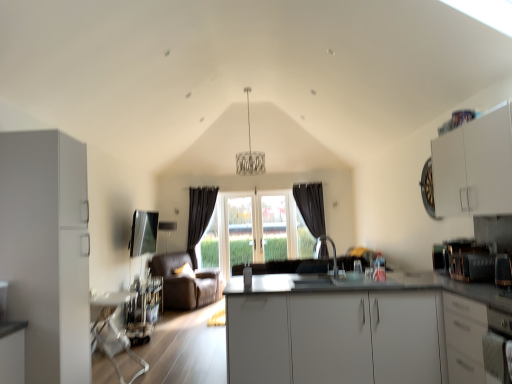
Question: Is point (203, 279) closer or farther from the camera than point (322, 188)?

Choices:
 (A) closer
 (B) farther

Answer: (A)

Question: Do you think brown leather armchair at center is within dark grey fabric curtain at center, the second curtain viewed from the left, or outside of it?

Choices:
 (A) inside
 (B) outside

Answer: (B)

Question: Which object is the closest to the dark fabric curtain at center, marked as the 2th curtain in a right-to-left arrangement?

Choices:
 (A) white glossy countertop at center
 (B) white matte cabinet at upper right, the first cabinetry from the right
 (C) transparent glass window at center
 (D) brown leather armchair at center
 (E) white matte cabinet at left, acting as the 3th cabinetry starting from the right

Answer: (D)

Question: Considering the real-world distances, which object is closest to the dark grey fabric curtain at center, the second curtain viewed from the left?

Choices:
 (A) transparent glass window at center
 (B) white matte cabinet at upper right, the first cabinetry from the right
 (C) white glossy countertop at center
 (D) white matte cabinet at left, acting as the 3th cabinetry starting from the right
 (E) satin silver oven at lower right

Answer: (A)